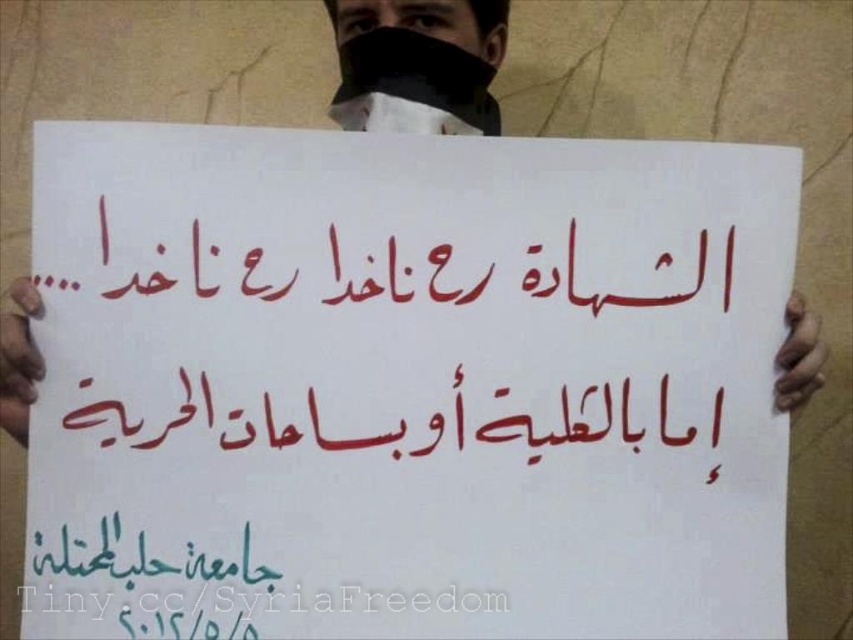
Which is below, white paper sign at center or red calligraphy at center?

white paper sign at center is lower down.

Who is taller, white paper sign at center or red calligraphy at center?

Standing taller between the two is white paper sign at center.

Is point (270, 230) farther from viewer compared to point (173, 349)?

No, it is not.

Where is `white paper sign at center`? Image resolution: width=853 pixels, height=640 pixels. white paper sign at center is located at coordinates (405, 385).

Is red calligraphy at center to the right of white paper at center from the viewer's perspective?

Yes, red calligraphy at center is to the right of white paper at center.

Does point (283, 326) come farther from viewer compared to point (466, 109)?

No, (283, 326) is in front of (466, 109).

Image resolution: width=853 pixels, height=640 pixels. Identify the location of red calligraphy at center. (401, 330).

Who is more distant from viewer, (x=648, y=371) or (x=350, y=32)?

The point (x=350, y=32) is behind.

Which of these two, red calligraphy at center or black fabric mask at upper center, stands taller?

black fabric mask at upper center is taller.

The width and height of the screenshot is (853, 640). I want to click on red calligraphy at center, so click(x=401, y=330).